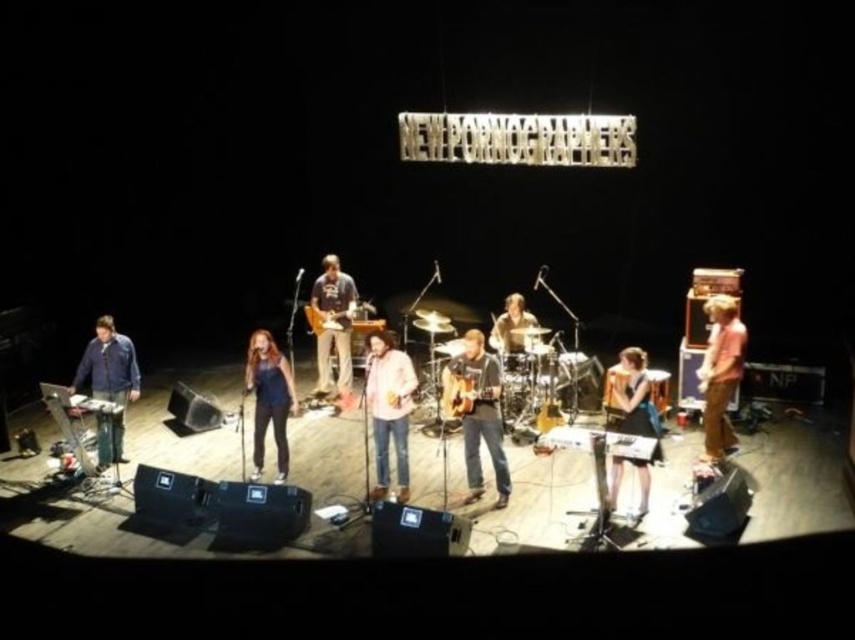
Question: Can you confirm if matte black dress at lower right is positioned above wooden acoustic guitar at center?

Choices:
 (A) yes
 (B) no

Answer: (B)

Question: Considering the real-world distances, which object is closest to the matte black shirt at center?

Choices:
 (A) acoustic guitar at center
 (B) matte black dress at lower right

Answer: (A)

Question: Is blue denim jeans at center positioned behind matte black dress at lower right?

Choices:
 (A) no
 (B) yes

Answer: (B)

Question: Which of the following is the farthest from the observer?

Choices:
 (A) (326, 368)
 (B) (516, 346)
 (C) (640, 518)
 (D) (251, 344)

Answer: (A)

Question: From the image, what is the correct spatial relationship of pink cotton shirt at right in relation to matte black dress at lower right?

Choices:
 (A) right
 (B) left

Answer: (A)

Question: Which of the following is the farthest from the observer?

Choices:
 (A) (649, 413)
 (B) (469, 397)

Answer: (B)